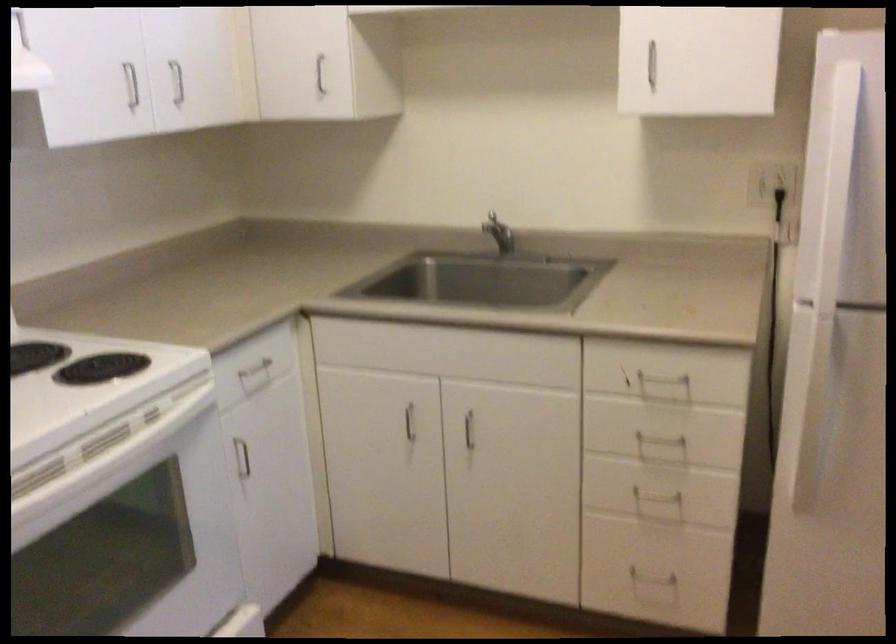
What do you see at coordinates (500, 236) in the screenshot?
I see `a faucet handle` at bounding box center [500, 236].